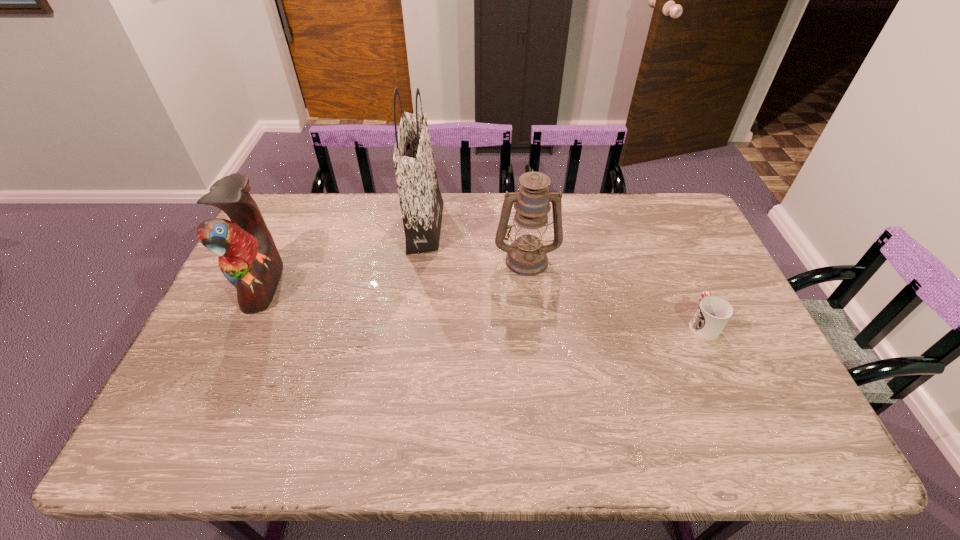
This screenshot has width=960, height=540. What are the coordinates of `vacant space located on the handle side of the rightmost object` in the screenshot? It's located at (661, 232).

This screenshot has width=960, height=540. I want to click on blank space located 0.170m on the handle side of the rightmost object, so pos(677,267).

Image resolution: width=960 pixels, height=540 pixels. Identify the location of object that is at the far edge. (421, 202).

In order to click on object that is at the left edge in this screenshot , I will do `click(248, 258)`.

Locate an element on the screen. Image resolution: width=960 pixels, height=540 pixels. object that is at the right edge is located at coordinates click(x=713, y=313).

The image size is (960, 540). Identify the location of free space at the far edge of the desktop. (592, 202).

In order to click on vacant area at the near edge in this screenshot , I will do click(x=599, y=457).

Where is `blank space at the left edge of the desktop`? The height and width of the screenshot is (540, 960). blank space at the left edge of the desktop is located at coordinates (266, 335).

Where is `vacant space at the right edge of the desktop`? This screenshot has width=960, height=540. vacant space at the right edge of the desktop is located at coordinates 744,340.

Where is `free point at the far left corner`? This screenshot has width=960, height=540. free point at the far left corner is located at coordinates (304, 200).